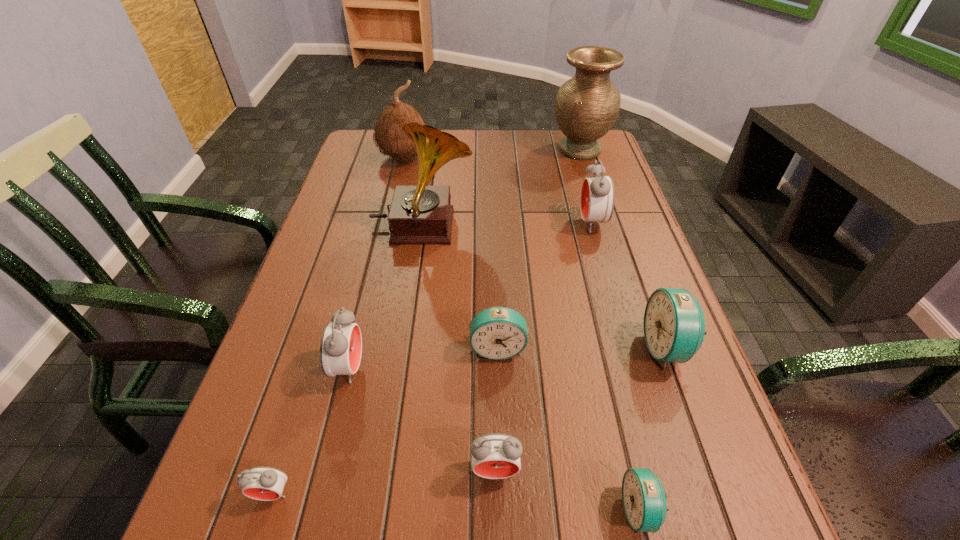
Find the location of a particular element. green vase is located at coordinates (586, 107).

I want to click on brown phonograph record, so click(x=421, y=214).

You are a GUI agent. You are given a task and a screenshot of the screen. Output one action in this format:
    pyautogui.click(x=<x>, y=<y>)
    Task: Click on the third tallest object
    The image size is (960, 540).
    Given the screenshot: What is the action you would take?
    pyautogui.click(x=389, y=136)

Find the location of a particular element. The width and height of the screenshot is (960, 540). the rightmost red alarm clock is located at coordinates (597, 198).

You are a GUI agent. You are given a task and a screenshot of the screen. Output one action in this format:
    pyautogui.click(x=<x>, y=<y>)
    Task: Click on the fourth tallest object
    The width and height of the screenshot is (960, 540).
    Given the screenshot: What is the action you would take?
    pyautogui.click(x=597, y=198)

What are the coordinates of `the third nearest red alarm clock` in the screenshot? It's located at (341, 343).

You are a GUI agent. You are given a task and a screenshot of the screen. Output one action in this format:
    pyautogui.click(x=<x>, y=<y>)
    Task: Click on the second alarm clock from left to right
    The image size is (960, 540).
    Given the screenshot: What is the action you would take?
    pyautogui.click(x=341, y=343)

You are a GUI agent. You are given a task and a screenshot of the screen. Output one action in this format:
    pyautogui.click(x=<x>, y=<y>)
    Task: Click on the rightmost alarm clock
    This screenshot has width=960, height=540.
    Given the screenshot: What is the action you would take?
    pos(674,326)

This screenshot has height=540, width=960. I want to click on the biggest blue alarm clock, so click(x=674, y=326).

Locate an element on the screen. The height and width of the screenshot is (540, 960). the second biggest blue alarm clock is located at coordinates (497, 333).